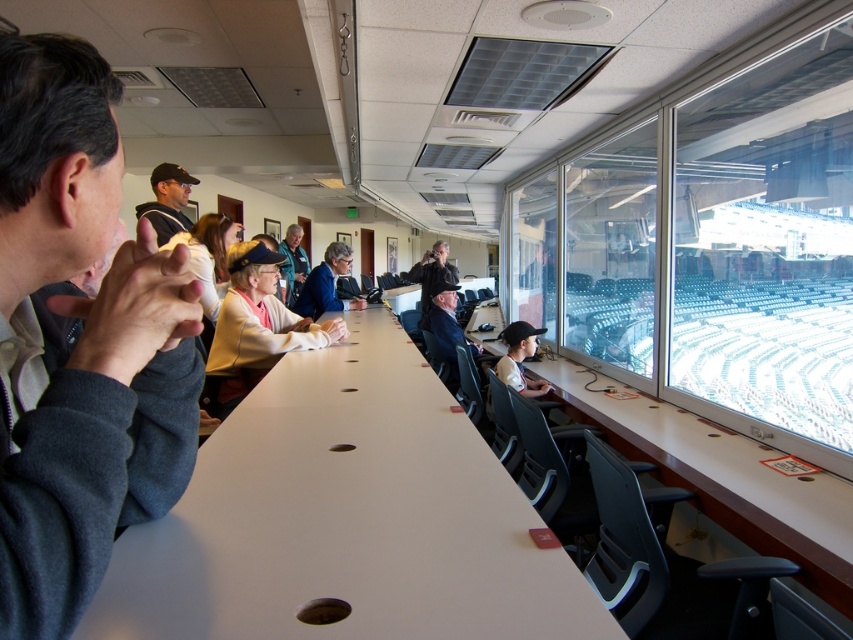
Is point (73, 296) closer to camera compared to point (338, 300)?

Yes.

Who is more forward, (55, 264) or (325, 308)?

Point (55, 264) is more forward.

Where is `gray fleece jacket at left`? gray fleece jacket at left is located at coordinates click(79, 342).

Which is more to the right, white matte table at center or light brown leather jacket at center?

From the viewer's perspective, white matte table at center appears more on the right side.

Where is `white matte table at center`? This screenshot has width=853, height=640. white matte table at center is located at coordinates (345, 518).

The height and width of the screenshot is (640, 853). Identify the location of white matte table at center. 345,518.

Can you confirm if gray fleece jacket at left is positioned below white fabric jacket at center?

No.

Which is behind, point (10, 275) or point (248, 308)?

The point (248, 308) is behind.

Identify the location of gray fleece jacket at left. (79, 342).